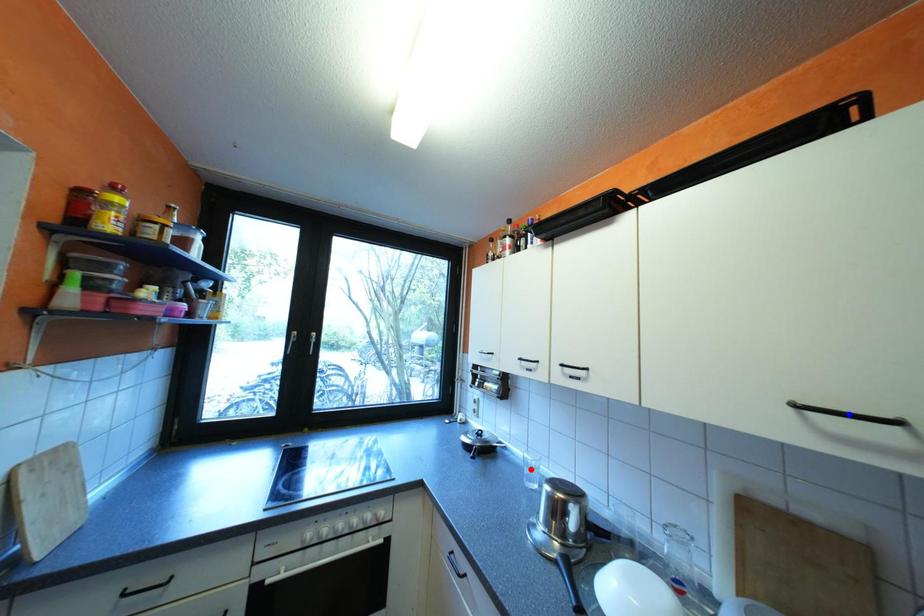
Question: In the image, two points are highlighted. Which point is nearer to the camera? Reply with the corresponding letter.

Choices:
 (A) blue point
 (B) red point

Answer: (A)